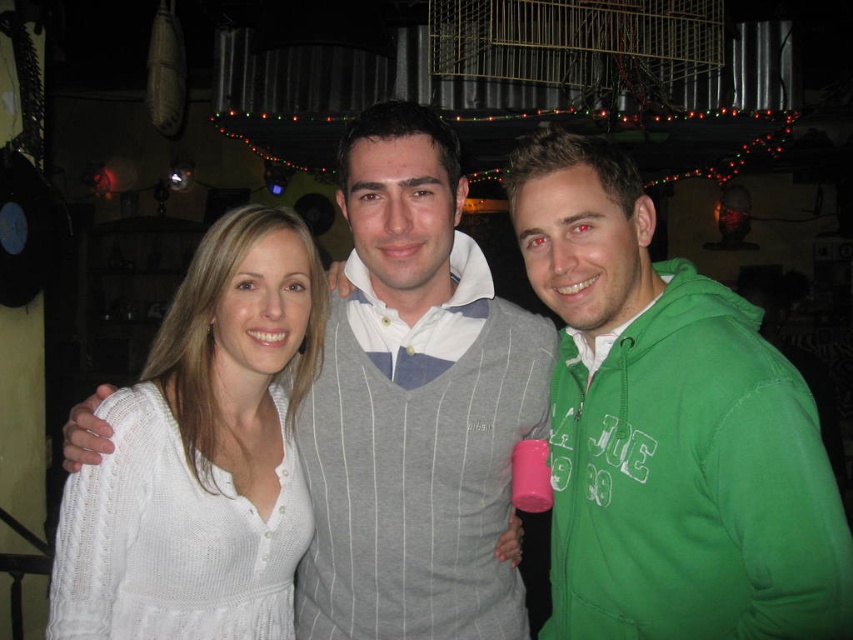
Locate an element on the screen. This screenshot has height=640, width=853. green fleece jacket at right is located at coordinates (668, 429).

Looking at this image, between green fleece jacket at right and white knitted sweater at center, which one appears on the left side from the viewer's perspective?

Positioned to the left is white knitted sweater at center.

Is point (599, 348) closer to viewer compared to point (250, 403)?

Yes, point (599, 348) is in front of point (250, 403).

This screenshot has width=853, height=640. I want to click on green fleece jacket at right, so click(668, 429).